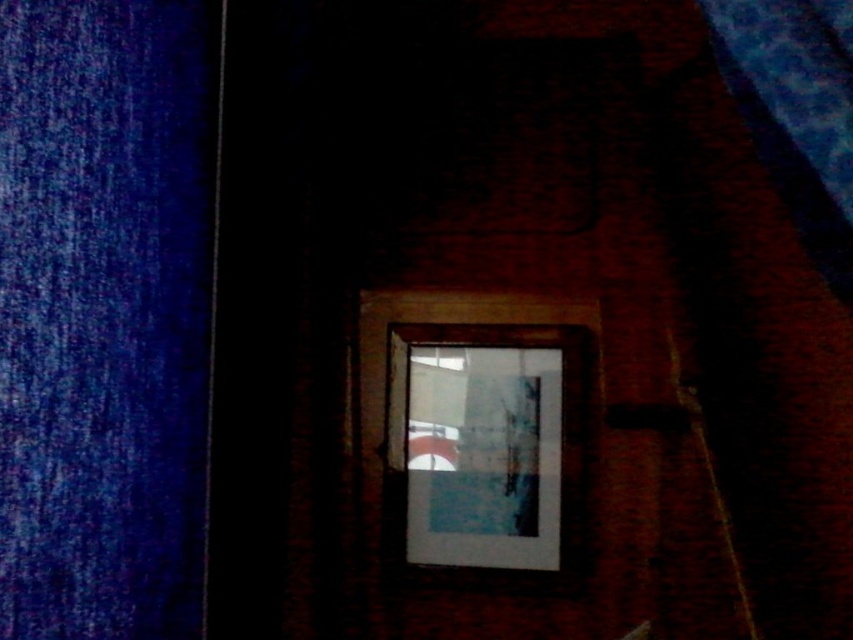
You are a photographer trying to capture a detailed shot of the brick wall and its window frame. You notice two points marked on your screen at coordinates point (x=80, y=499) and point (x=457, y=554). Which point should you focus on first to ensure both are in sharp focus?

You should focus on point (x=80, y=499) first because it is closer to the camera than point (x=457, y=554). By focusing on the closer point, you can ensure that both points will be in sharp focus if they are within the depth of field.